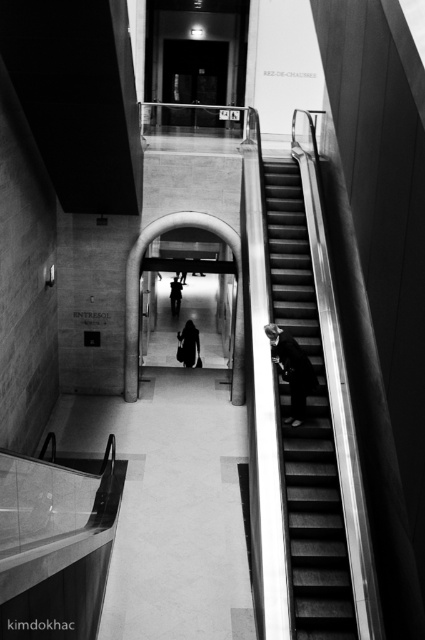
Question: Is dark gray suit at right thinner than dark fabric coat at center?

Choices:
 (A) no
 (B) yes

Answer: (A)

Question: Which point is closer to the camera?

Choices:
 (A) (183, 348)
 (B) (317, 628)

Answer: (B)

Question: Which point is closer to the camera?

Choices:
 (A) dark fabric coat at center
 (B) dark gray suit at right
 (C) dark fabric bag at center

Answer: (B)

Question: Among these objects, which one is farthest from the camera?

Choices:
 (A) dark gray suit at right
 (B) dark fabric coat at center

Answer: (B)

Question: In this image, where is metallic silver stairs at right located relative to dark fabric coat at center?

Choices:
 (A) above
 (B) below

Answer: (B)

Question: Can you confirm if metallic silver stairs at right is positioned above dark fabric bag at center?

Choices:
 (A) yes
 (B) no

Answer: (B)